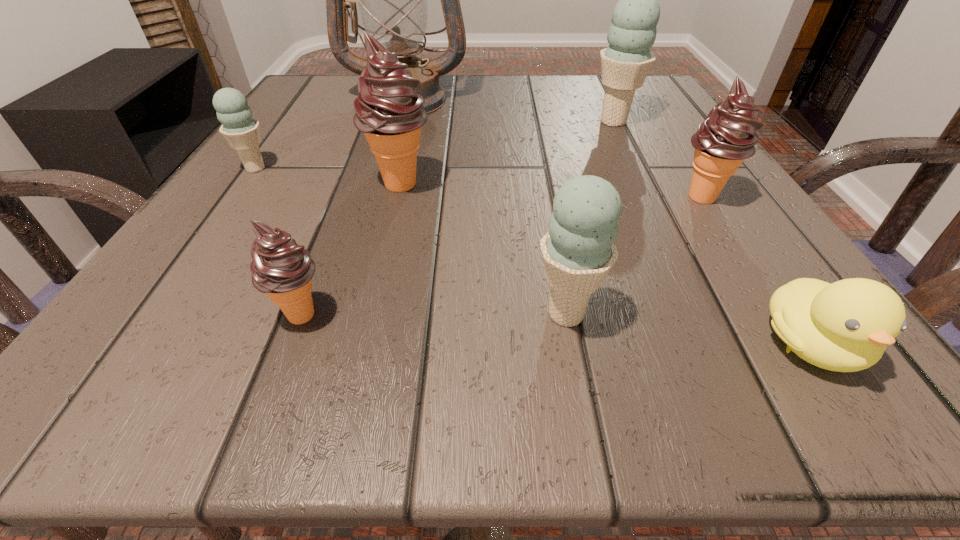
Identify the location of free spot between the second biggest blue ice cream and the second biggest chocolate icecream. The image size is (960, 540). (635, 255).

Locate an element on the screen. The width and height of the screenshot is (960, 540). empty space that is in between the shortest object and the second smallest chocolate icecream is located at coordinates (756, 271).

Find the location of a particular element. The image size is (960, 540). vacant space that's between the second biggest chocolate icecream and the farthest blue ice cream is located at coordinates (658, 159).

Locate an element on the screen. blank region between the biggest chocolate icecream and the second biggest chocolate icecream is located at coordinates (551, 190).

Locate an element on the screen. The width and height of the screenshot is (960, 540). free space between the nearest chocolate icecream and the second smallest blue ice cream is located at coordinates (434, 314).

Where is `vacant region between the rightmost chocolate icecream and the brown oil lamp`? This screenshot has width=960, height=540. vacant region between the rightmost chocolate icecream and the brown oil lamp is located at coordinates (554, 148).

At what (x,y) coordinates should I click in order to perform the action: click on free space between the smallest chocolate icecream and the rightmost chocolate icecream. Please return your answer as a coordinate pair (x, y). The height and width of the screenshot is (540, 960). Looking at the image, I should click on (502, 255).

Select which object appears as the third closest to the rightmost chocolate icecream. Please provide its 2D coordinates. Your answer should be formatted as a tuple, i.e. [(x, y)], where the tuple contains the x and y coordinates of a point satisfying the conditions above.

[(578, 251)]

Identify which object is located as the third nearest to the fifth object from left to right. Please provide its 2D coordinates. Your answer should be formatted as a tuple, i.e. [(x, y)], where the tuple contains the x and y coordinates of a point satisfying the conditions above.

[(390, 113)]

I want to click on the second closest icecream relative to the fourth icecream from left to right, so click(x=390, y=113).